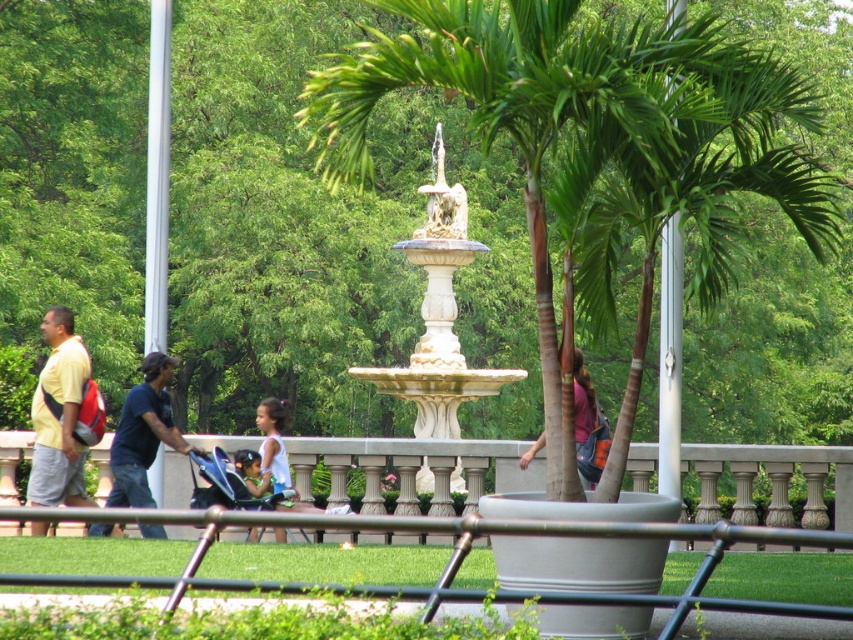
You are standing in the park and want to walk from point A to point B. Point A is at coordinates point (54, 422) and point B is at coordinates point (135, 472). Which point is closer to you?

Point A at coordinates point (54, 422) is closer to you since it is further to the viewer than point B at coordinates point (135, 472).

You are standing in the park and see the yellow matte shirt at left and the white fabric dress at center. Which clothing item is positioned higher from the ground?

The yellow matte shirt at left is located above the white fabric dress at center, so it is positioned higher from the ground.